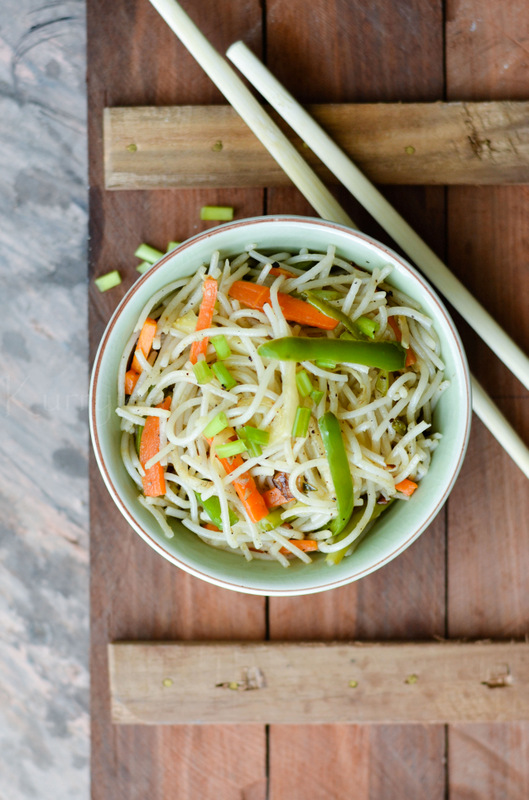
Where is `vertical boards`? Image resolution: width=529 pixels, height=800 pixels. vertical boards is located at coordinates click(202, 754), click(304, 754), click(478, 762).